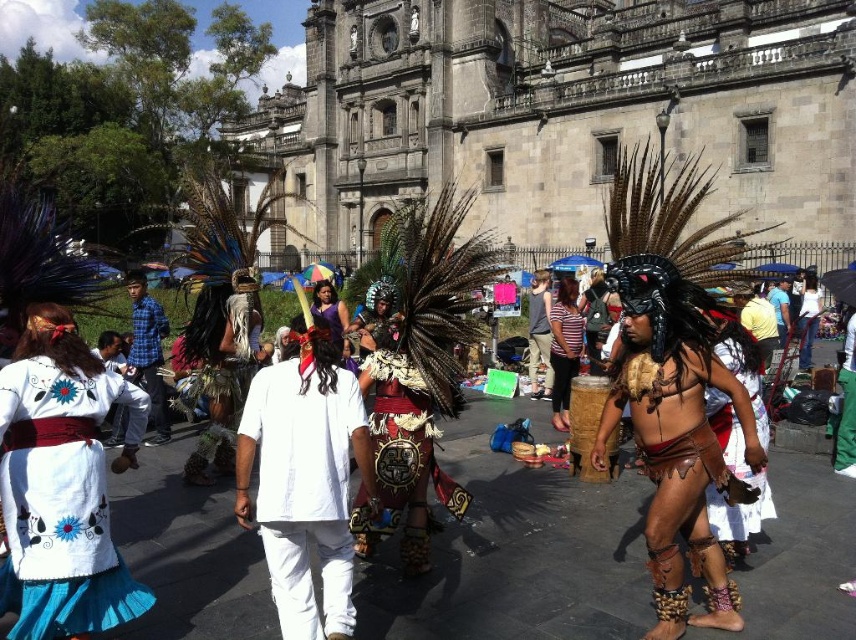
Question: Among these objects, which one is farthest from the camera?

Choices:
 (A) blue plaid shirt at center
 (B) white cotton shirt at center

Answer: (A)

Question: Which of the following is the farthest from the observer?

Choices:
 (A) (143, 276)
 (B) (804, 317)
 (C) (551, 406)
 (D) (67, 461)

Answer: (B)

Question: Where is brown leather skirt at lower right located in relation to matte brown drum at center in the image?

Choices:
 (A) right
 (B) left

Answer: (A)

Question: Estimate the real-world distances between objects in this image. Which object is closer to the blue plaid shirt at center?

Choices:
 (A) striped fabric skirt at center
 (B) brown leather headdress at center
 (C) white cotton shirt at center
 (D) brown leather skirt at lower right

Answer: (C)

Question: Does white cotton shirt at center have a lesser width compared to blue plaid shirt at center?

Choices:
 (A) yes
 (B) no

Answer: (A)

Question: Is brown leather skirt at lower right to the left of blue plaid shirt at center from the viewer's perspective?

Choices:
 (A) yes
 (B) no

Answer: (B)